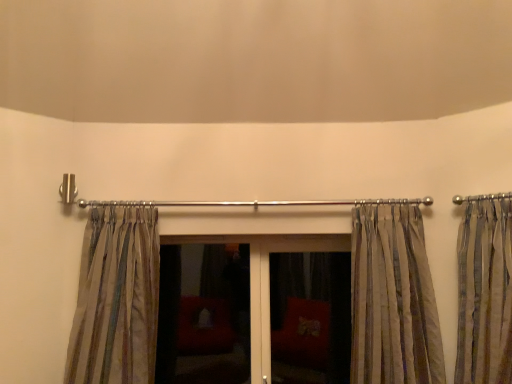
Question: Considering the relative sizes of matte glass screen door at center, marked as the second screen door in a right-to-left arrangement, and matte glass door at center in the image provided, is matte glass screen door at center, marked as the second screen door in a right-to-left arrangement, taller than matte glass door at center?

Choices:
 (A) yes
 (B) no

Answer: (B)

Question: Is matte glass door at center located within matte glass screen door at center, arranged as the first screen door when viewed from the left?

Choices:
 (A) yes
 (B) no

Answer: (B)

Question: Considering the relative sizes of matte glass screen door at center, marked as the second screen door in a right-to-left arrangement, and matte glass door at center in the image provided, is matte glass screen door at center, marked as the second screen door in a right-to-left arrangement, thinner than matte glass door at center?

Choices:
 (A) no
 (B) yes

Answer: (B)

Question: Considering the relative positions of matte glass screen door at center, arranged as the first screen door when viewed from the left, and matte glass door at center in the image provided, is matte glass screen door at center, arranged as the first screen door when viewed from the left, to the left of matte glass door at center from the viewer's perspective?

Choices:
 (A) no
 (B) yes

Answer: (B)

Question: From the image's perspective, is matte glass screen door at center, arranged as the first screen door when viewed from the left, beneath matte glass door at center?

Choices:
 (A) no
 (B) yes

Answer: (A)

Question: Can you confirm if matte glass screen door at center, marked as the second screen door in a right-to-left arrangement, is smaller than matte glass door at center?

Choices:
 (A) no
 (B) yes

Answer: (B)

Question: From a real-world perspective, does silky beige curtains at right, the 3th curtain viewed from the left, sit lower than matte glass screen door at center, arranged as the first screen door when viewed from the left?

Choices:
 (A) yes
 (B) no

Answer: (B)

Question: Is silky beige curtains at right, which is the first curtain from right to left, further to the viewer compared to matte glass screen door at center, marked as the second screen door in a right-to-left arrangement?

Choices:
 (A) no
 (B) yes

Answer: (A)

Question: Is silky beige curtains at right, which is the first curtain from right to left, positioned with its back to matte glass screen door at center, arranged as the first screen door when viewed from the left?

Choices:
 (A) yes
 (B) no

Answer: (B)

Question: Is silky beige curtains at right, which is the first curtain from right to left, completely or partially outside of matte glass screen door at center, arranged as the first screen door when viewed from the left?

Choices:
 (A) no
 (B) yes

Answer: (B)

Question: Is silky beige curtains at right, the 3th curtain viewed from the left, to the right of matte glass screen door at center, marked as the second screen door in a right-to-left arrangement, from the viewer's perspective?

Choices:
 (A) no
 (B) yes

Answer: (B)

Question: From a real-world perspective, is silky beige curtains at right, the 3th curtain viewed from the left, located higher than matte glass screen door at center, arranged as the first screen door when viewed from the left?

Choices:
 (A) no
 (B) yes

Answer: (B)

Question: Does matte glass screen door at center, the 1th screen door in the right-to-left sequence, appear on the right side of silky beige curtain at left, acting as the 3th curtain starting from the right?

Choices:
 (A) no
 (B) yes

Answer: (B)